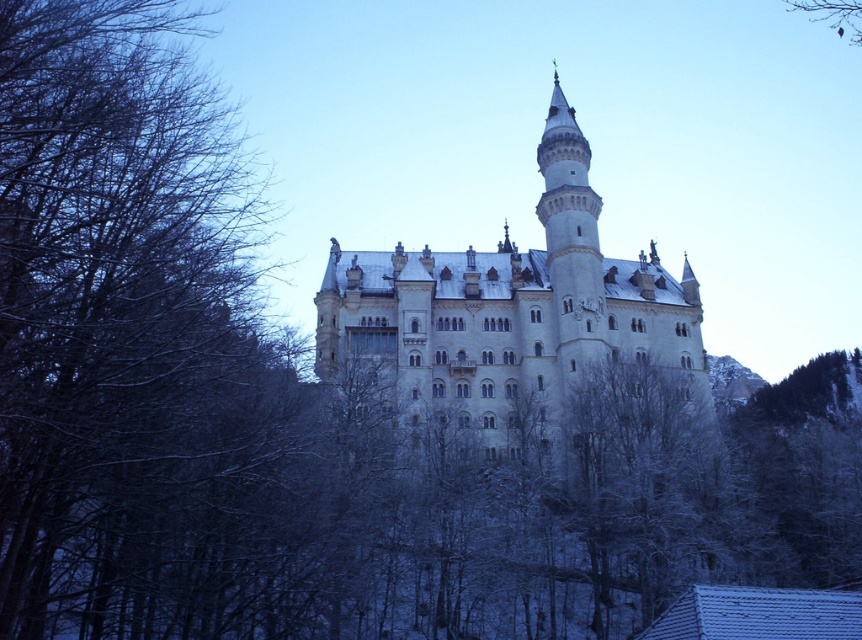
Who is shorter, white stone castle at center or brown textured branch at upper right?

brown textured branch at upper right is shorter.

Is the position of white stone castle at center less distant than that of brown textured branch at upper right?

Yes, white stone castle at center is closer to the viewer.

You are a GUI agent. You are given a task and a screenshot of the screen. Output one action in this format:
    pyautogui.click(x=<x>, y=<y>)
    Task: Click on the white stone castle at center
    This screenshot has height=640, width=862.
    Given the screenshot: What is the action you would take?
    pos(508,312)